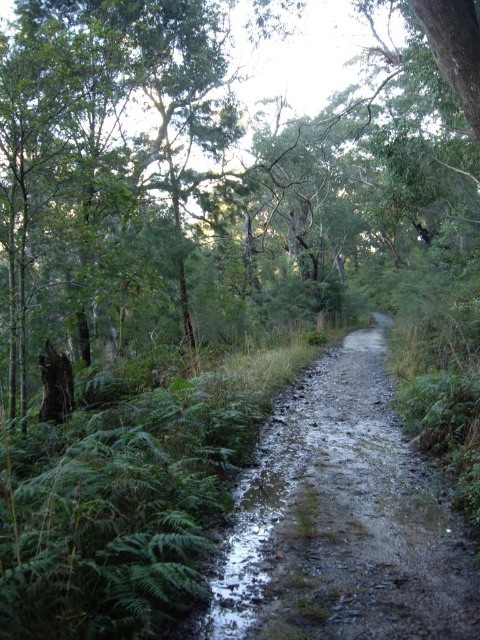
You are a hiker carrying a heavy backpack and need to reach a cabin located 25 meters ahead. The cabin is directly ahead along the muddy gravel path at center. There is a brown rough tree at center blocking your path. Can you safely walk around the tree without deviating from the path?

The brown rough tree at center is 21.60 meters away from the muddy gravel path at center. Since the tree is not on the path itself, you can safely walk around it while staying on the muddy gravel path at center to reach the cabin 25 meters ahead.

You are hiking along a narrow muddy path through a dense forest. You notice two points marked on your map at coordinates point [40,74] and point [240,602]. Which point is closer to you as you stand on the path?

Point [40,74] is further to the camera than point [240,602], so the closer point to you is point [240,602].